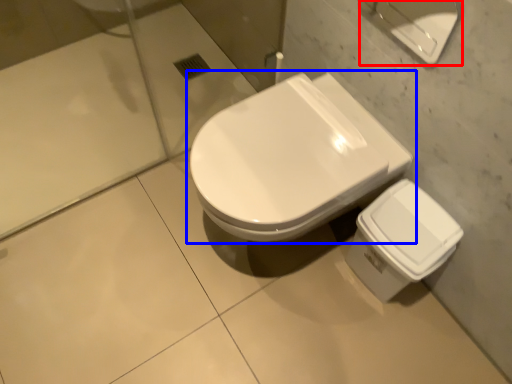
Question: Which point is closer to the camera, porcelain (highlighted by a red box) or toilet (highlighted by a blue box)?

Choices:
 (A) porcelain
 (B) toilet

Answer: (A)